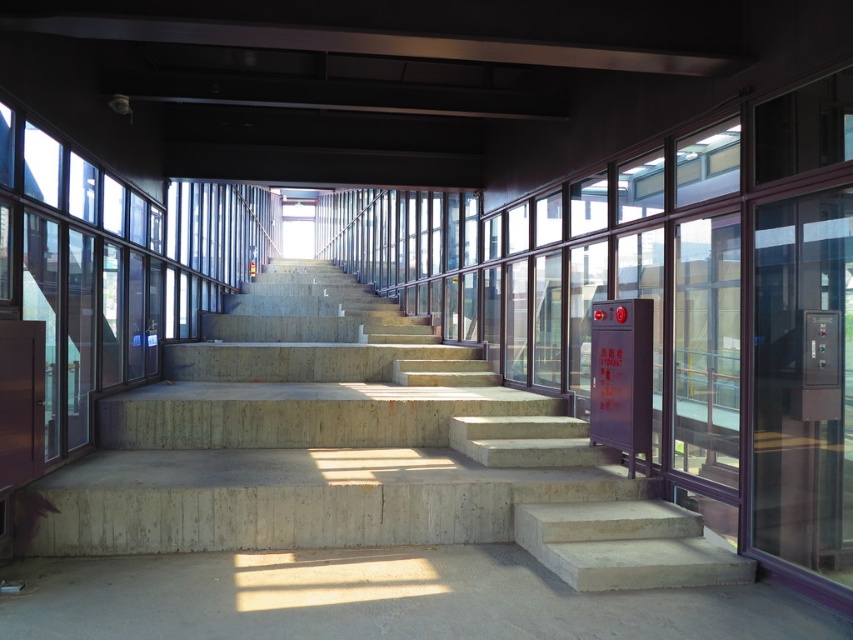
Question: Estimate the real-world distances between objects in this image. Which object is closer to the gray concrete steps at center?

Choices:
 (A) transparent glass door at right
 (B) concrete stairs at center

Answer: (A)

Question: Does concrete stairs at center appear over transparent glass door at right?

Choices:
 (A) yes
 (B) no

Answer: (A)

Question: Where is gray concrete steps at center located in relation to transparent glass door at right in the image?

Choices:
 (A) left
 (B) right

Answer: (A)

Question: Among these points, which one is farthest from the camera?

Choices:
 (A) (788, 253)
 (B) (180, 556)
 (C) (32, 500)

Answer: (B)

Question: Is concrete stairs at center behind transparent glass door at right?

Choices:
 (A) no
 (B) yes

Answer: (B)

Question: Which point is farther from the camera taking this photo?

Choices:
 (A) (769, 474)
 (B) (355, 628)
 (C) (193, 408)

Answer: (C)